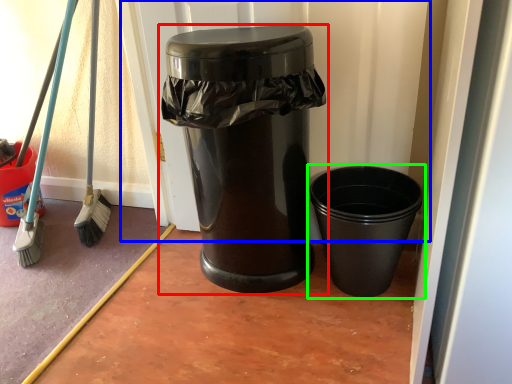
Question: Which object is positioned farthest from waste container (highlighted by a red box)? Select from screen door (highlighted by a blue box) and waste container (highlighted by a green box).

Choices:
 (A) screen door
 (B) waste container

Answer: (B)